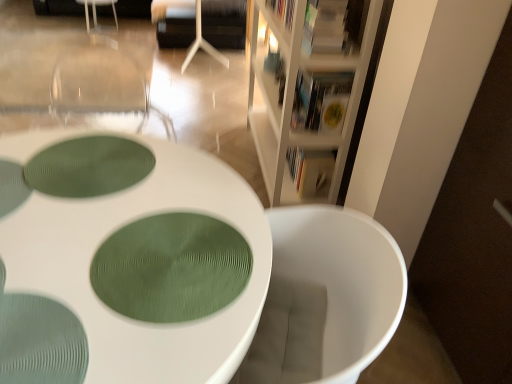
Question: Considering the positions of green textured placemat at center, the second oval when ordered from front to back, and white textured table at center in the image, is green textured placemat at center, the second oval when ordered from front to back, taller or shorter than white textured table at center?

Choices:
 (A) tall
 (B) short

Answer: (B)

Question: From a real-world perspective, is green textured placemat at center, the second oval when ordered from front to back, above or below white textured table at center?

Choices:
 (A) below
 (B) above

Answer: (B)

Question: Which object is the closest to the green textured oval at center, marked as the 1th oval in a front-to-back arrangement?

Choices:
 (A) white wood bookcase at upper right
 (B) white textured table at center
 (C) green textured placemat at center, the 1th oval positioned from the back
 (D) matte white book at upper right, placed as the 1th book when sorted from top to bottom
 (E) hardcover book at upper center, the 2th book positioned from the bottom

Answer: (B)

Question: Based on their relative distances, which object is farther from the white textured table at center?

Choices:
 (A) green textured placemat at center, the 1th oval positioned from the back
 (B) white matte armchair at upper center
 (C) white wood bookcase at upper right
 (D) hardcover book at upper center, the 2th book positioned from the bottom
 (E) matte white book at upper right, which is the third book from back to front

Answer: (B)